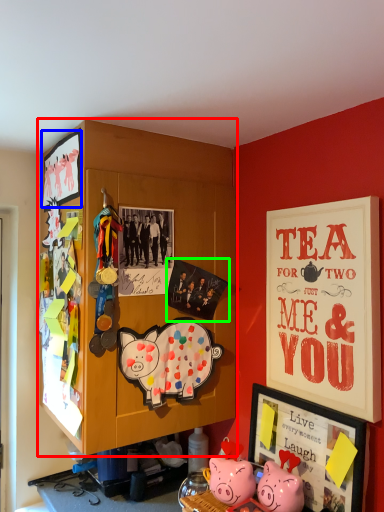
Question: Which object is positioned farthest from cabinetry (highlighted by a red box)? Select from picture frame (highlighted by a blue box) and poster page (highlighted by a green box).

Choices:
 (A) picture frame
 (B) poster page

Answer: (A)